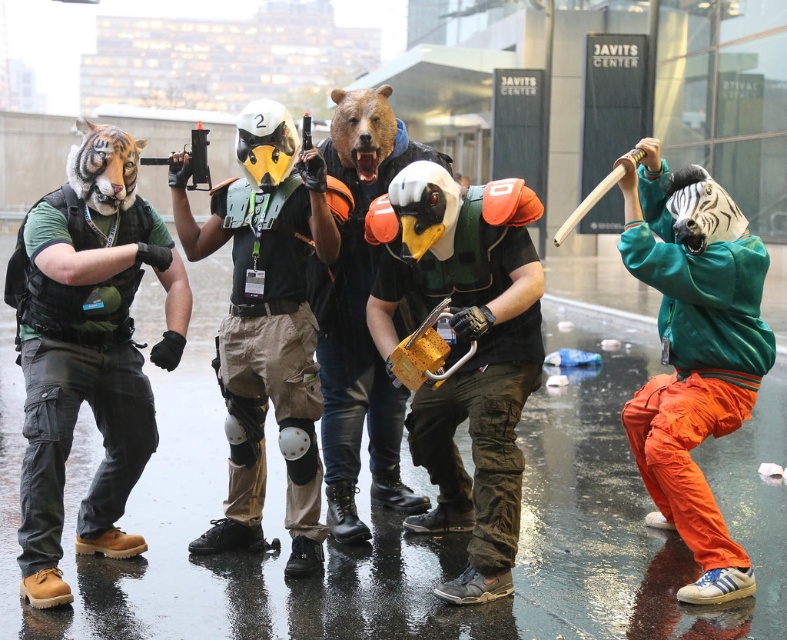
Does matte green helmet at center appear over brown matte bear mask at center?

Answer: No.

Does matte green helmet at center have a larger size compared to brown matte bear mask at center?

Correct, matte green helmet at center is larger in size than brown matte bear mask at center.

Who is more distant from viewer, (512, 362) or (345, 180)?

The point (345, 180) is behind.

Find the location of a particular element. The width and height of the screenshot is (787, 640). matte green helmet at center is located at coordinates (467, 356).

Does matte black vest at left appear under matte black helmet at center?

Yes.

Is matte black vest at left above matte black helmet at center?

Actually, matte black vest at left is below matte black helmet at center.

Where is `matte black vest at left`? This screenshot has height=640, width=787. matte black vest at left is located at coordinates (87, 348).

Does velvet green hoodie at right appear on the right side of brown matte bear mask at center?

Yes, velvet green hoodie at right is to the right of brown matte bear mask at center.

Who is shorter, velvet green hoodie at right or brown matte bear mask at center?

Standing shorter between the two is velvet green hoodie at right.

Which is behind, point (723, 307) or point (313, 285)?

Point (313, 285)

In order to click on velvet green hoodie at right in this screenshot , I will do `click(693, 353)`.